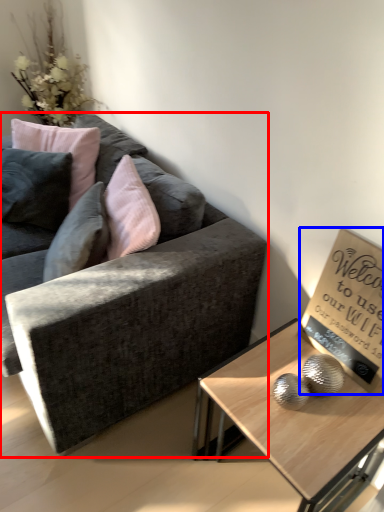
Question: Which point is closer to the camera, studio couch (highlighted by a red box) or bulletin board (highlighted by a blue box)?

Choices:
 (A) studio couch
 (B) bulletin board

Answer: (A)